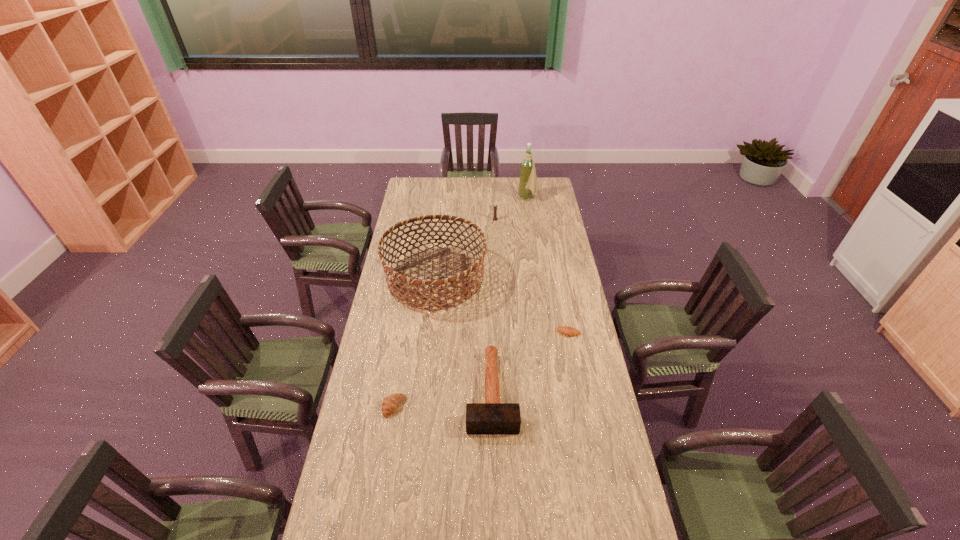
I want to click on the farther crescent roll, so click(566, 330).

Where is `vacant position located on the front-facing side of the wine bottle`? vacant position located on the front-facing side of the wine bottle is located at coordinates (456, 198).

In order to click on vacant region located 0.220m on the front-facing side of the wine bottle in this screenshot , I will do (482, 198).

Locate an element on the screen. This screenshot has height=540, width=960. vacant area situated 0.060m on the front-facing side of the wine bottle is located at coordinates (509, 198).

Where is `vacant position located 0.240m on the right of the basket`? This screenshot has height=540, width=960. vacant position located 0.240m on the right of the basket is located at coordinates (536, 279).

Where is `vacant space located on the back of the third tallest object`? The height and width of the screenshot is (540, 960). vacant space located on the back of the third tallest object is located at coordinates (493, 186).

Locate an element on the screen. The height and width of the screenshot is (540, 960). free space located 0.180m on the hammer head face of the third shortest object is located at coordinates (494, 488).

What are the coordinates of `blank area located 0.360m on the back of the left crescent roll` in the screenshot? It's located at (407, 324).

Locate an element on the screen. vacant point located on the left of the farther crescent roll is located at coordinates (485, 333).

The width and height of the screenshot is (960, 540). I want to click on object at the far edge, so click(528, 180).